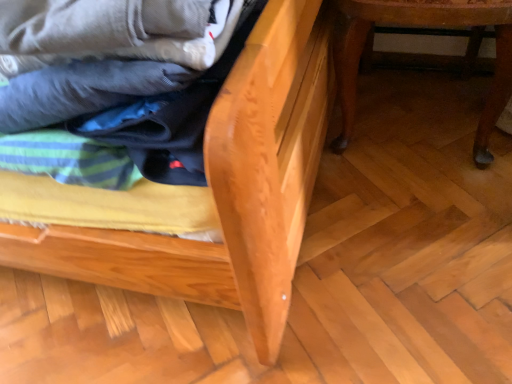
At what (x,y) coordinates should I click in order to perform the action: click on vacant space underneath wooden table at lower right, which ranks as the second furniture in left-to-right order (from a real-world perspective). Please return your answer as a coordinate pair (x, y). Looking at the image, I should click on (410, 109).